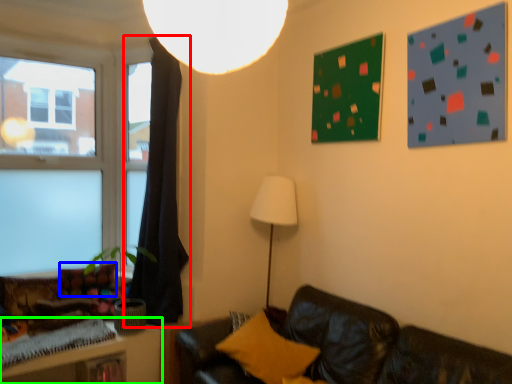
Question: Estimate the real-world distances between objects in this image. Which object is closer to curtain (highlighted by a red box), pillow (highlighted by a blue box) or table (highlighted by a green box)?

Choices:
 (A) pillow
 (B) table

Answer: (A)